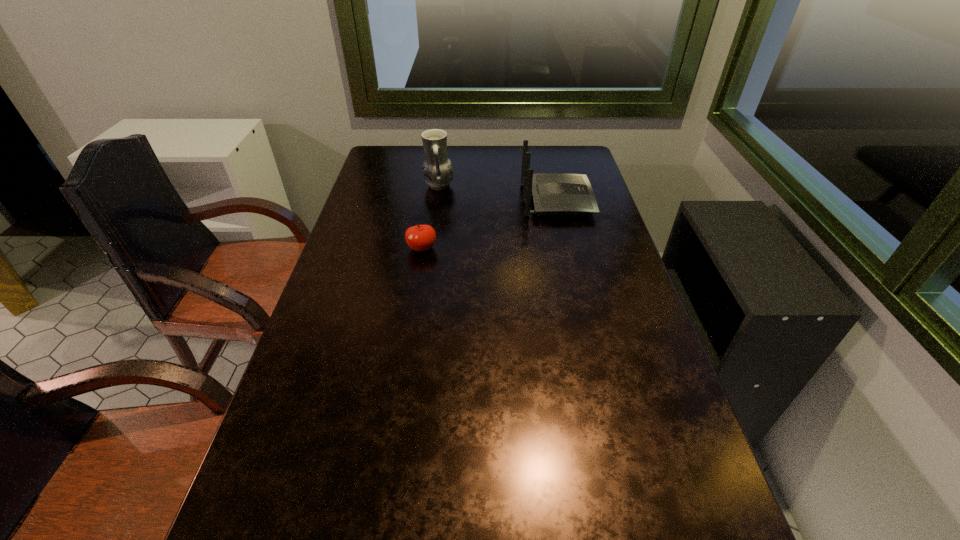
You are a GUI agent. You are given a task and a screenshot of the screen. Output one action in this format:
    pyautogui.click(x=<x>, y=<y>)
    Task: Click on the pottery
    This screenshot has width=960, height=540.
    Given the screenshot: What is the action you would take?
    pyautogui.click(x=437, y=169)

Identify the location of router. (553, 193).

Locate an element on the screen. The width and height of the screenshot is (960, 540). the nearest object is located at coordinates (421, 237).

At what (x,y) coordinates should I click in order to perform the action: click on the shortest object. Please return your answer as a coordinate pair (x, y). Looking at the image, I should click on (421, 237).

Locate an element on the screen. Image resolution: width=960 pixels, height=540 pixels. vacant space located 0.050m on the front of the pottery is located at coordinates (437, 205).

You are a GUI agent. You are given a task and a screenshot of the screen. Output one action in this format:
    pyautogui.click(x=<x>, y=<y>)
    Task: Click on the free spot located 0.160m on the front of the shortest object
    The image size is (960, 540).
    Given the screenshot: What is the action you would take?
    pyautogui.click(x=414, y=296)

Identify the location of object at the far edge. (437, 169).

Find the location of a particular element. object at the right edge is located at coordinates (553, 193).

In the image, there is a desktop. Identify the location of vacant region at the far edge. (458, 167).

In the image, there is a desktop. Where is `vacant space at the left edge`? The height and width of the screenshot is (540, 960). vacant space at the left edge is located at coordinates (392, 212).